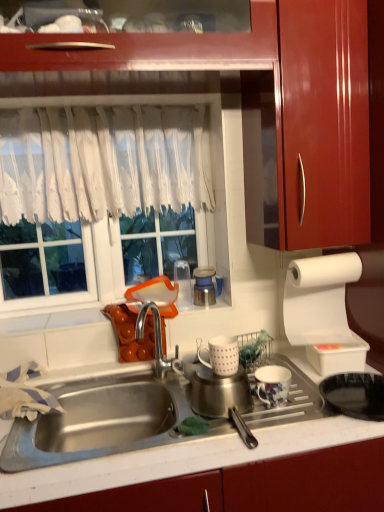
Question: Is floral ceramic mug at lower center, acting as the second tableware starting from the left, taller or shorter than metallic blue thermos at center, which ranks as the first appliance in back-to-front order?

Choices:
 (A) short
 (B) tall

Answer: (A)

Question: Is floral ceramic mug at lower center, placed as the first tableware when sorted from right to left, inside or outside of metallic blue thermos at center, which is the 2th appliance in right-to-left order?

Choices:
 (A) outside
 (B) inside

Answer: (A)

Question: Estimate the real-world distances between objects in this image. Which object is closer to the glossy wood cabinet at upper right?

Choices:
 (A) floral ceramic mug at lower center, the 2th tableware in the top-to-bottom sequence
 (B) metallic blue thermos at center, the first appliance when ordered from left to right
 (C) white lace curtain at upper center
 (D) black matte frying pan at lower right
 (E) white lace curtain at upper center

Answer: (E)

Question: Considering the real-world distances, which object is farthest from the floral ceramic mug at lower center, the 1th tableware from the bottom?

Choices:
 (A) white matte mug at center, which is the second tableware from bottom to top
 (B) white paper at right
 (C) metallic blue thermos at center, placed as the second appliance when sorted from front to back
 (D) white lace curtain at upper center
 (E) black matte frying pan at lower right

Answer: (D)